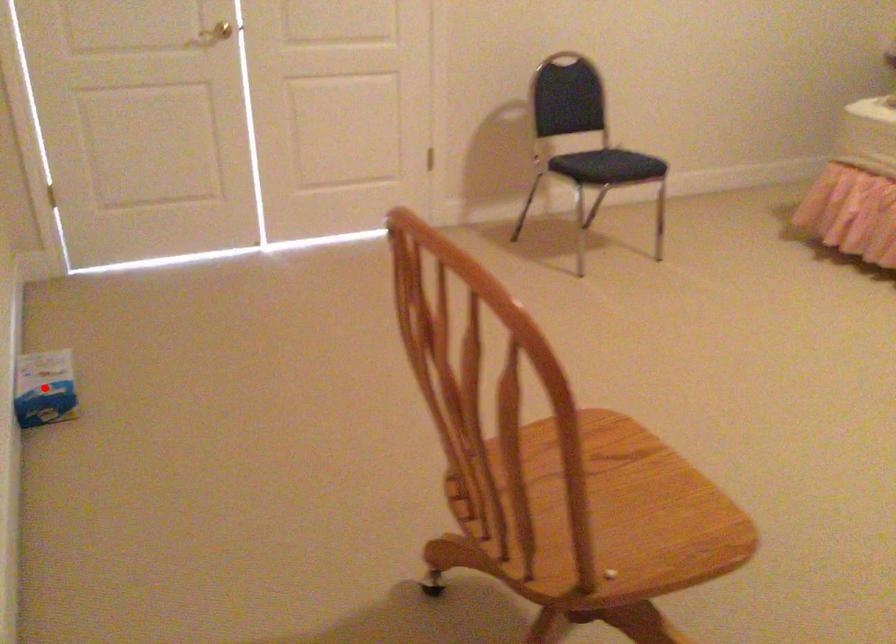
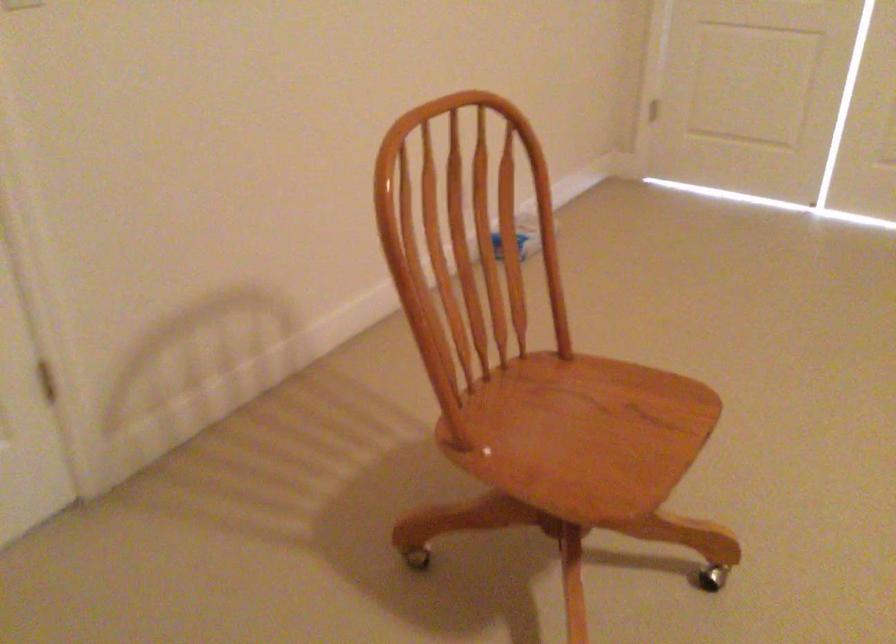
Question: I am providing you with two images of the same scene from different viewpoints. A red point is marked on the first image. Can you still see the location of the red point in image 2?

Choices:
 (A) Yes
 (B) No

Answer: (B)